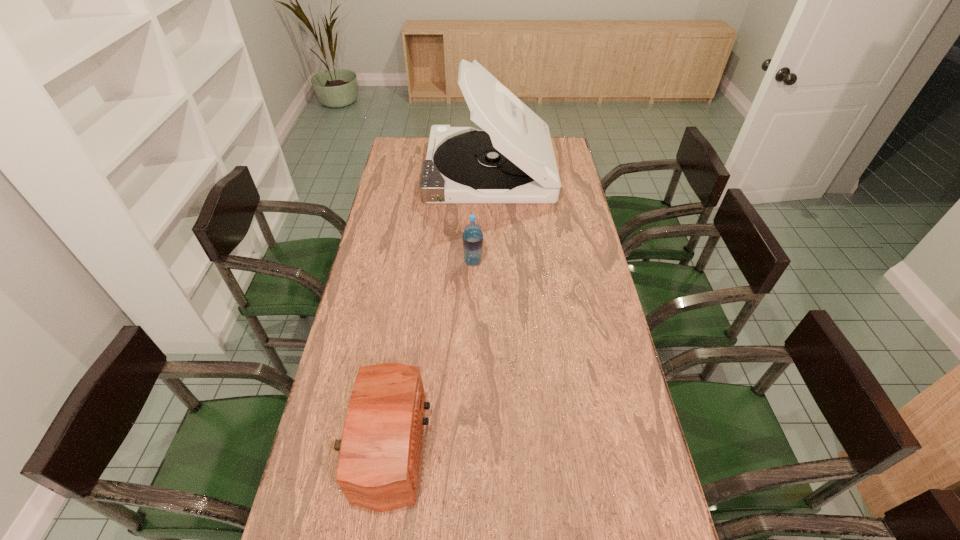
Locate an element on the screen. This screenshot has width=960, height=540. object that is at the right edge is located at coordinates (511, 160).

In order to click on object that is at the far right corner in this screenshot , I will do `click(511, 160)`.

I want to click on vacant space at the left edge of the desktop, so click(345, 336).

What are the coordinates of `free space at the right edge of the desktop` in the screenshot? It's located at (602, 383).

Locate an element on the screen. This screenshot has height=540, width=960. vacant space at the far left corner of the desktop is located at coordinates (394, 147).

I want to click on free point between the second farthest object and the CD player, so click(x=481, y=215).

This screenshot has width=960, height=540. I want to click on free space between the nearest object and the CD player, so pyautogui.click(x=434, y=308).

Locate an element on the screen. empty space that is in between the second farthest object and the nearest object is located at coordinates (426, 354).

Choose which object is the nearest neighbor to the farthest object. Please provide its 2D coordinates. Your answer should be formatted as a tuple, i.e. [(x, y)], where the tuple contains the x and y coordinates of a point satisfying the conditions above.

[(472, 236)]

Where is `the closest object to the farthest object`? the closest object to the farthest object is located at coordinates (472, 236).